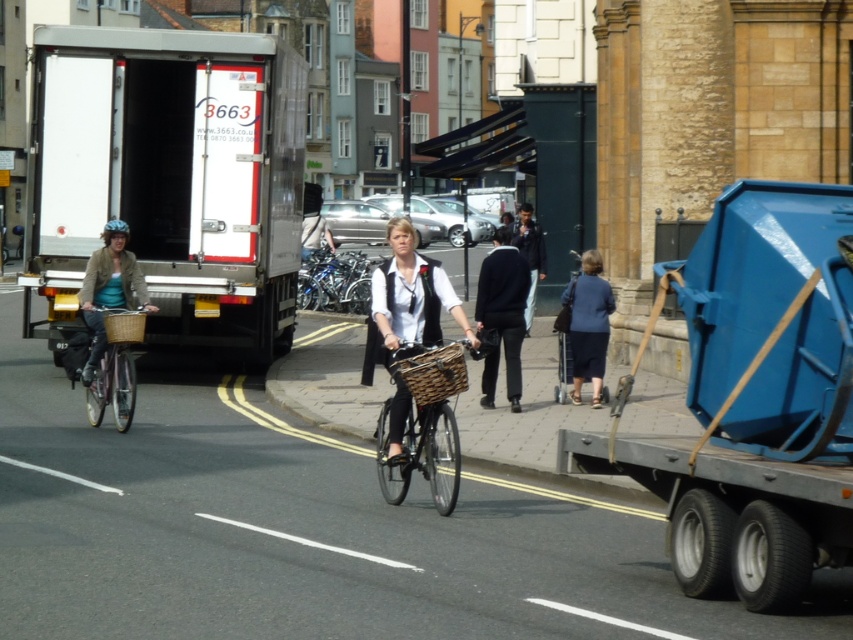
Question: Is dark blue sweater at center above dark blue jacket at center?

Choices:
 (A) yes
 (B) no

Answer: (B)

Question: Does white matte truck at left lie behind blue plastic container at right?

Choices:
 (A) yes
 (B) no

Answer: (A)

Question: Among these points, which one is farthest from the camera?

Choices:
 (A) (381, 452)
 (B) (485, 320)
 (C) (248, 76)
 (D) (363, 298)

Answer: (D)

Question: Among these objects, which one is nearest to the camera?

Choices:
 (A) matte wicker basket at left
 (B) matte wicker basket at center

Answer: (B)

Question: Which of the following is the farthest from the observer?

Choices:
 (A) blue fabric dress at lower right
 (B) wooden woven basket at center
 (C) matte wicker basket at left

Answer: (A)

Question: Is matte wicker basket at center to the left of shiny metallic bicycle at center from the viewer's perspective?

Choices:
 (A) no
 (B) yes

Answer: (A)